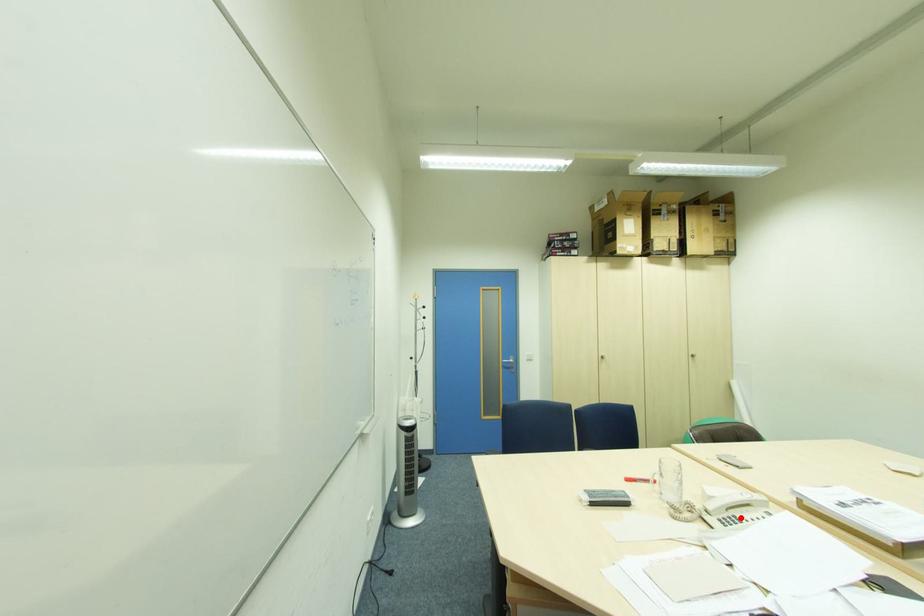
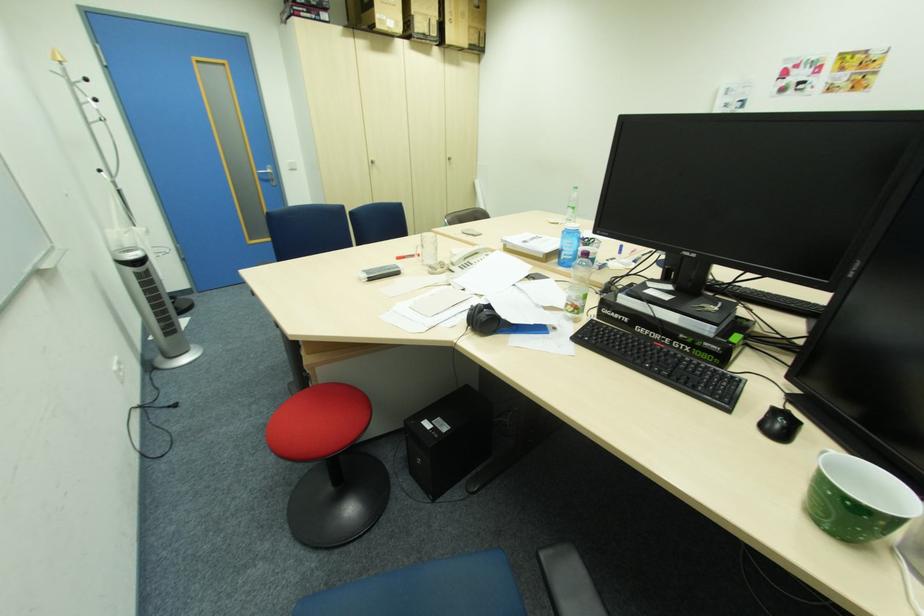
Find the pixel in the second image that matches the highlighted location in the first image.

(475, 262)